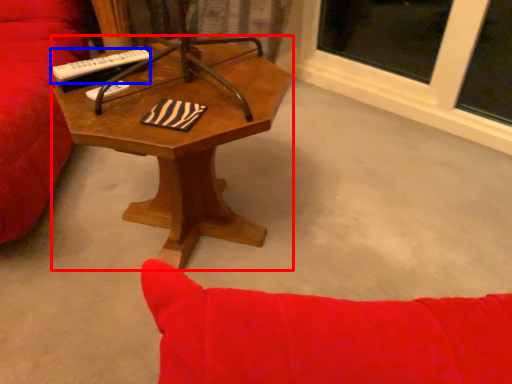
Question: Which object is further to the camera taking this photo, coffee table (highlighted by a red box) or remote control (highlighted by a blue box)?

Choices:
 (A) coffee table
 (B) remote control

Answer: (B)